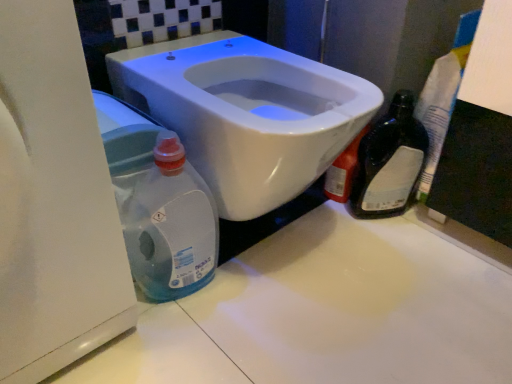
Locate an element on the screen. space that is in front of black glass bottle at right is located at coordinates (393, 249).